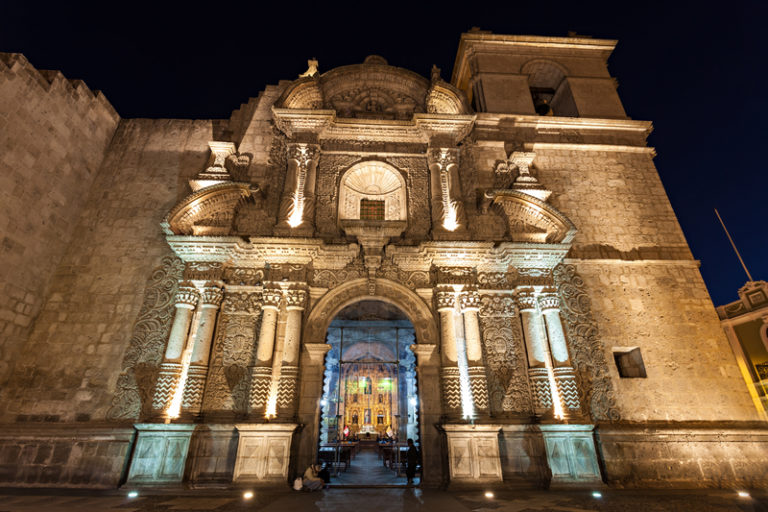
Where is `gold rectangular shaped door`? Image resolution: width=768 pixels, height=512 pixels. gold rectangular shaped door is located at coordinates (356, 402), (372, 400).